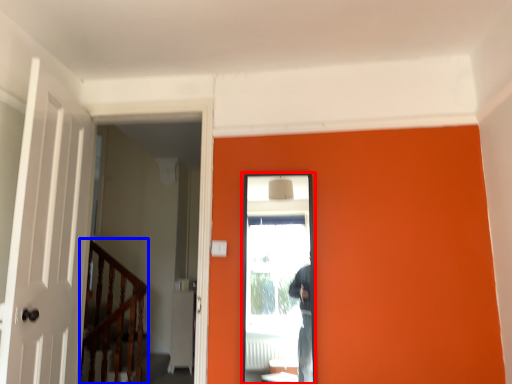
Question: Which object appears closest to the camera in this image, screen door (highlighted by a red box) or rail (highlighted by a blue box)?

Choices:
 (A) screen door
 (B) rail

Answer: (A)